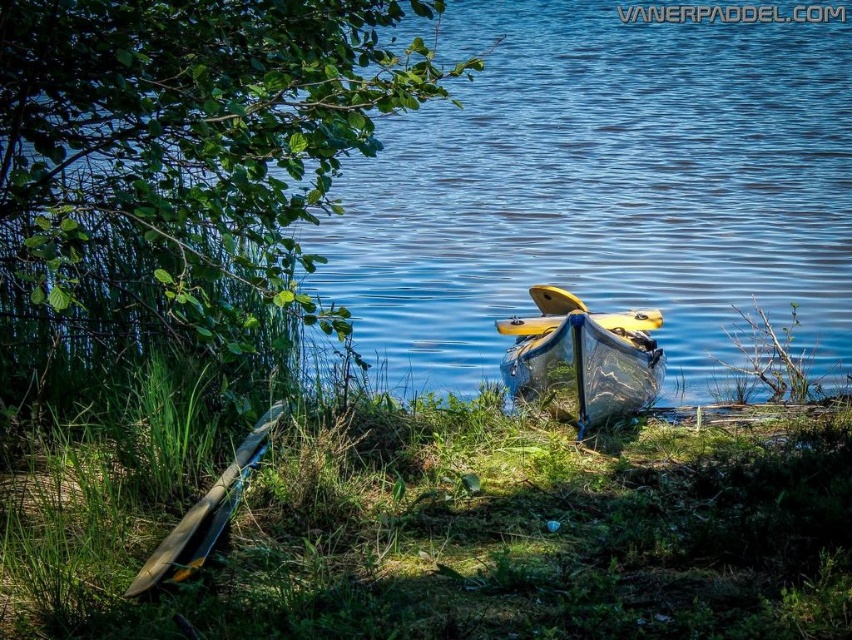
Does green leafy tree at upper left appear on the left side of matte yellow canoe at lower left?

Indeed, green leafy tree at upper left is positioned on the left side of matte yellow canoe at lower left.

Measure the distance from green leafy tree at upper left to matte yellow canoe at lower left.

The distance of green leafy tree at upper left from matte yellow canoe at lower left is 4.28 feet.

Does point (128, 109) come farther from viewer compared to point (237, 476)?

That is True.

At what (x,y) coordinates should I click in order to perform the action: click on green leafy tree at upper left. Please return your answer as a coordinate pair (x, y). Looking at the image, I should click on (187, 150).

Can you confirm if green grass at lower left is thinner than matte yellow canoe at lower left?

In fact, green grass at lower left might be wider than matte yellow canoe at lower left.

Which of these two, green grass at lower left or matte yellow canoe at lower left, stands taller?

green grass at lower left is taller.

This screenshot has height=640, width=852. What do you see at coordinates (471, 532) in the screenshot? I see `green grass at lower left` at bounding box center [471, 532].

This screenshot has height=640, width=852. In order to click on green grass at lower left in this screenshot , I will do `click(471, 532)`.

Is yellow glossy kayak at center wider than matte yellow canoe at lower left?

Indeed, yellow glossy kayak at center has a greater width compared to matte yellow canoe at lower left.

Can you confirm if yellow glossy kayak at center is positioned above matte yellow canoe at lower left?

Indeed, yellow glossy kayak at center is positioned over matte yellow canoe at lower left.

Based on the photo, who is more distant from viewer, (x=619, y=353) or (x=197, y=525)?

Point (x=619, y=353)

Locate an element on the screen. The image size is (852, 640). yellow glossy kayak at center is located at coordinates (582, 356).